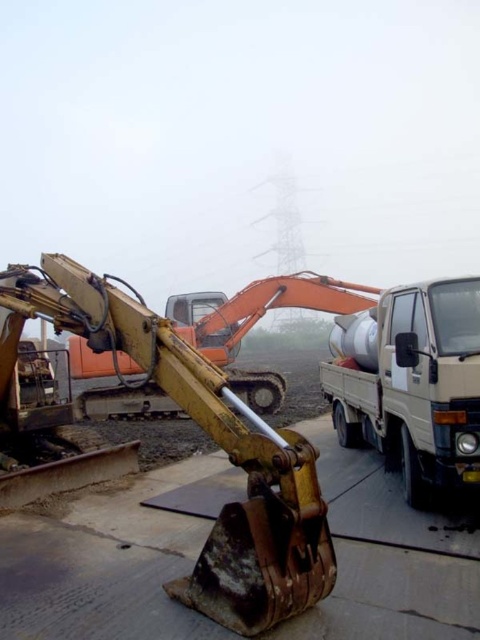
Question: Is rusty metal cement at lower center further to camera compared to white matte truck at lower right?

Choices:
 (A) no
 (B) yes

Answer: (B)

Question: Can you confirm if rusty metal cement at lower center is positioned to the right of white matte truck at lower right?

Choices:
 (A) yes
 (B) no

Answer: (B)

Question: Can you confirm if rusty metal cement at lower center is thinner than white matte truck at lower right?

Choices:
 (A) yes
 (B) no

Answer: (B)

Question: Which point appears farthest from the camera in this image?

Choices:
 (A) (338, 502)
 (B) (397, 308)

Answer: (B)

Question: Which object is farther from the camera taking this photo?

Choices:
 (A) rusty metal cement at lower center
 (B) white matte truck at lower right

Answer: (A)